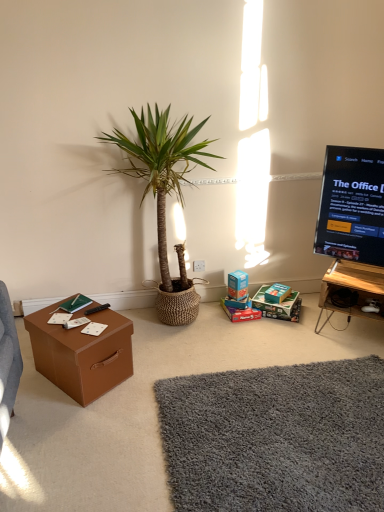
Locate an element on the screen. free space between brown cardboard box at lower left and matte cardboard box at lower center, which ranks as the 3th storage box in right-to-left order is located at coordinates (181, 341).